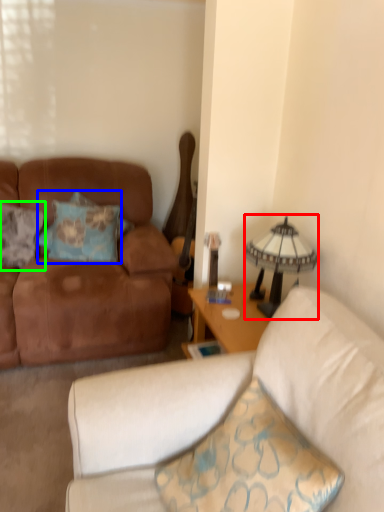
Question: Considering the real-world distances, which object is closest to lamp (highlighted by a red box)? pillow (highlighted by a blue box) or pillow (highlighted by a green box).

Choices:
 (A) pillow
 (B) pillow

Answer: (A)